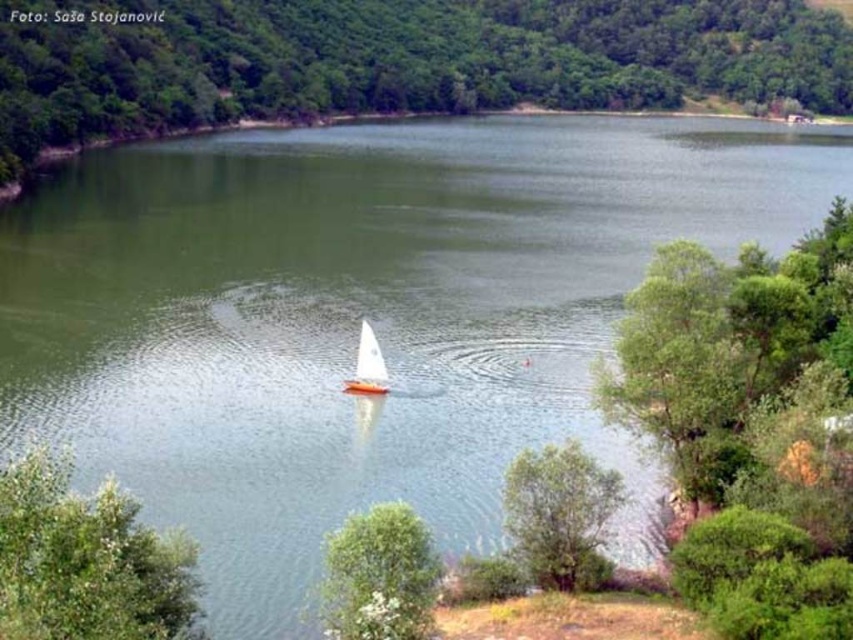
Which is behind, point (113, 497) or point (535, 502)?

The point (535, 502) is more distant.

Who is positioned more to the left, green leafy tree at lower left or green leafy tree at lower right?

green leafy tree at lower left is more to the left.

Which is in front, point (25, 518) or point (521, 545)?

Point (25, 518) is in front.

The width and height of the screenshot is (853, 640). In order to click on green leafy tree at lower left in this screenshot , I will do [86, 561].

Is green leafy tree at lower center wider than white matte sailboat at center?

Yes, green leafy tree at lower center is wider than white matte sailboat at center.

Between point (379, 614) and point (363, 337), which one is positioned in front?

Point (379, 614) is in front.

What do you see at coordinates (379, 576) in the screenshot?
I see `green leafy tree at lower center` at bounding box center [379, 576].

Find the location of `green leafy tree at lower center`. green leafy tree at lower center is located at coordinates (379, 576).

Can you confirm if green leafy tree at lower right is positioned below white matte sailboat at center?

Yes, green leafy tree at lower right is below white matte sailboat at center.

Is green leafy tree at lower right above white matte sailboat at center?

No, green leafy tree at lower right is not above white matte sailboat at center.

Is point (563, 545) behind point (376, 385)?

No.

The image size is (853, 640). Identify the location of green leafy tree at lower right. (560, 515).